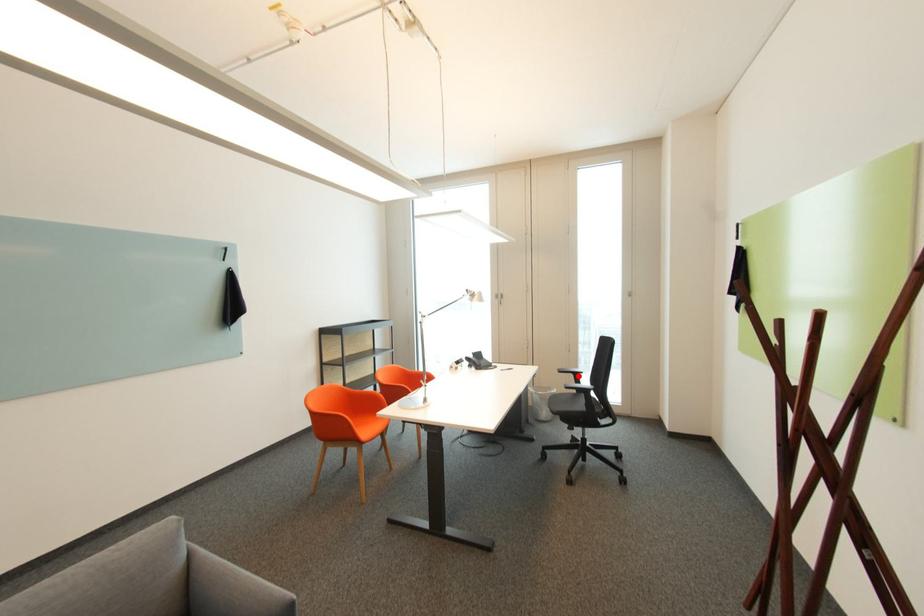
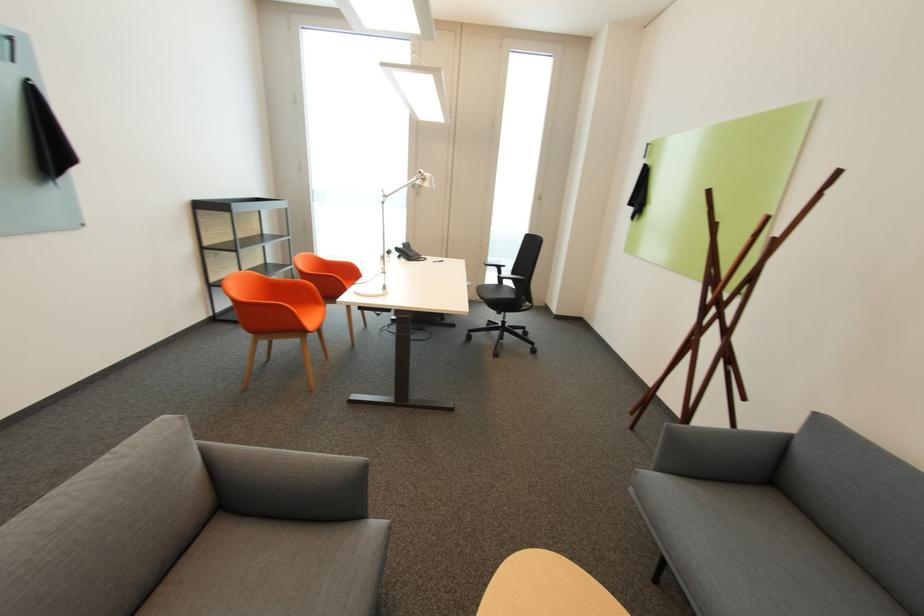
Where in the second image is the point corresponding to the highlighted location from the first image?

(503, 269)